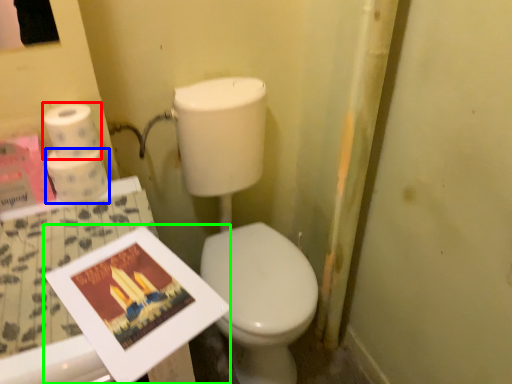
Question: Estimate the real-world distances between objects in this image. Which object is farther from toilet paper (highlighted by a red box), toilet paper (highlighted by a blue box) or magazine (highlighted by a green box)?

Choices:
 (A) toilet paper
 (B) magazine

Answer: (B)